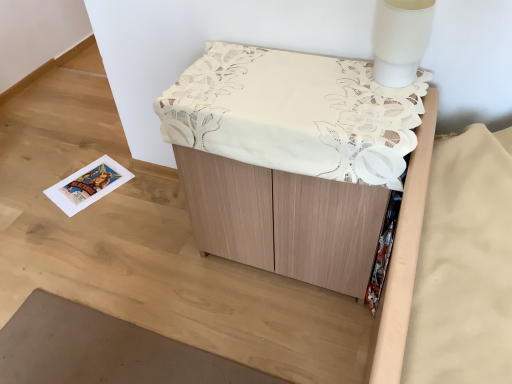
Locate an element on the screen. free space on the front side of wooden cabinet at center is located at coordinates (275, 337).